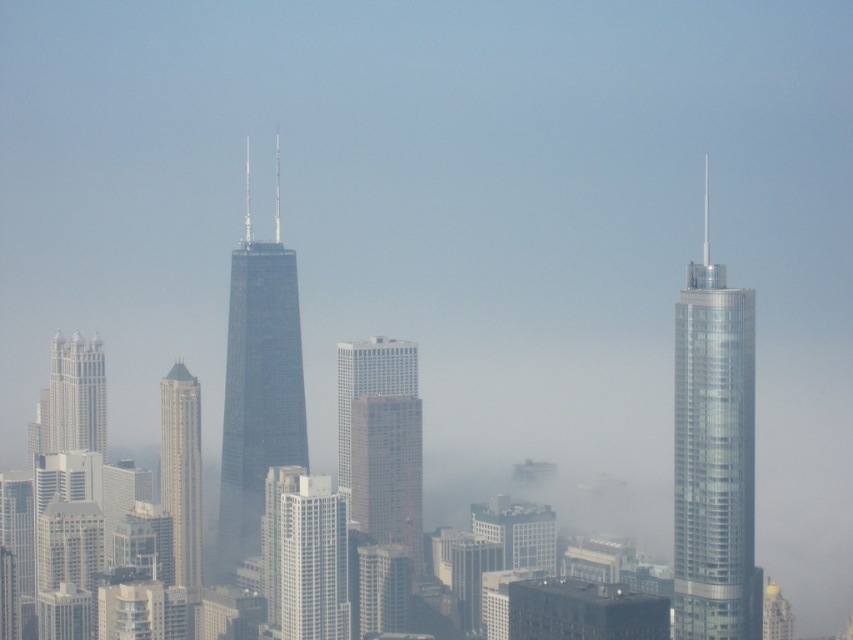
You are a drone operator planning to fly a drone from the white textured building at center to the clear glass skyscraper at right. Based on the cityscape scene, which direction should you direct the drone to reach its destination?

The clear glass skyscraper at right is to the right of the white textured building at center, so you should direct the drone to the right to reach the clear glass skyscraper at right.

Consider the image. You are an urban planner assessing a cityscape with two key buildings. The white textured building at center and the white glossy building at left are both under consideration for new antenna installations. Based on their heights, which building would require a crane with a higher lifting capacity to install the antenna at the top?

The white textured building at center requires a crane with higher lifting capacity because it is taller than the white glossy building at left.